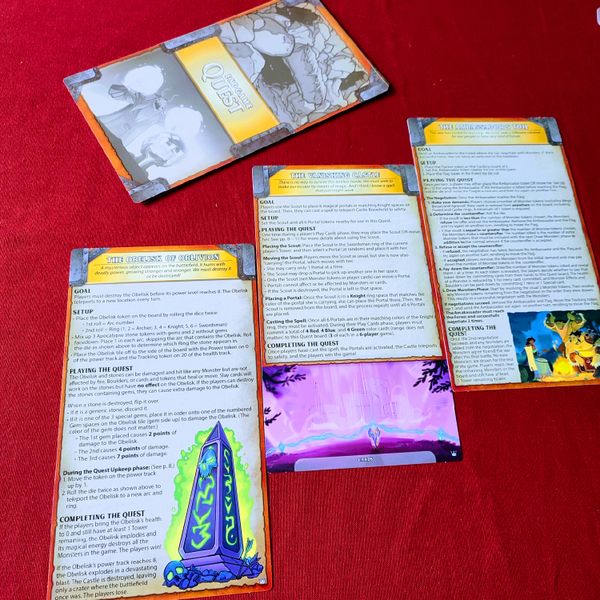
You are a GUI agent. You are given a task and a screenshot of the screen. Output one action in this format:
    pyautogui.click(x=<x>, y=<y>)
    Task: Click on the table
    This screenshot has height=600, width=600.
    Given the screenshot: What is the action you would take?
    pyautogui.click(x=396, y=535)